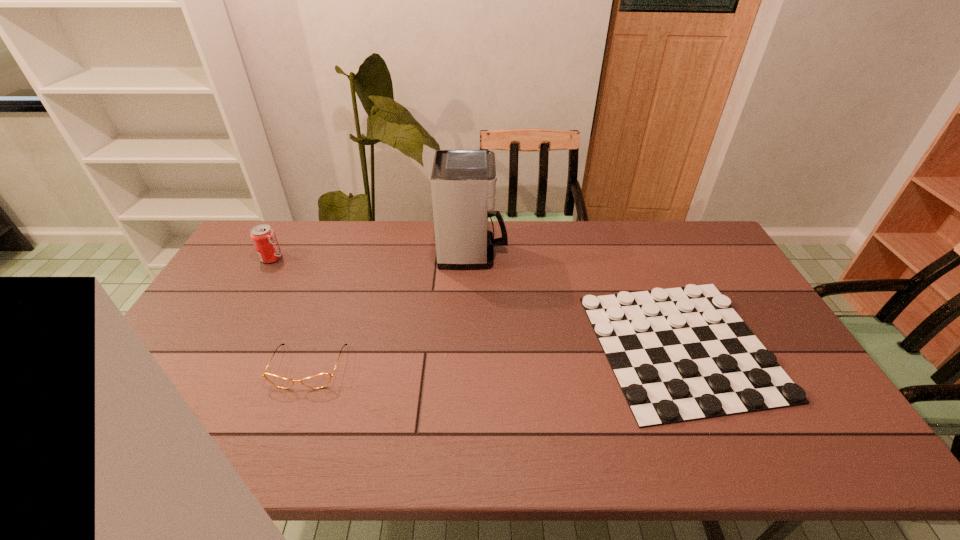
The width and height of the screenshot is (960, 540). Identify the location of the third object from left to right. click(463, 182).

Identify the location of coffee maker. The image size is (960, 540). (463, 182).

At what (x,y) coordinates should I click in order to perform the action: click on soda can. Please return your answer as a coordinate pair (x, y). Looking at the image, I should click on (264, 239).

You are a GUI agent. You are given a task and a screenshot of the screen. Output one action in this format:
    pyautogui.click(x=<x>, y=<y>)
    Task: Click on the leftmost object
    
    Given the screenshot: What is the action you would take?
    pyautogui.click(x=264, y=239)

This screenshot has height=540, width=960. I want to click on the second object from left to right, so click(318, 381).

In order to click on the second shortest object in this screenshot , I will do pos(318,381).

At what (x,y) coordinates should I click in order to perform the action: click on gameboard. Please return your answer as a coordinate pair (x, y). The image size is (960, 540). Looking at the image, I should click on (680, 354).

You are a GUI agent. You are given a task and a screenshot of the screen. Output one action in this format:
    pyautogui.click(x=<x>, y=<y>)
    Task: Click on the rightmost object
    The image size is (960, 540).
    Given the screenshot: What is the action you would take?
    pyautogui.click(x=680, y=354)

The height and width of the screenshot is (540, 960). I want to click on vacant space located 0.260m on the front panel of the third object from left to right, so click(581, 253).

At what (x,y) coordinates should I click in order to perform the action: click on vacant point located 0.080m on the front of the leftmost object. Please return your answer as a coordinate pair (x, y). This screenshot has height=540, width=960. Looking at the image, I should click on tap(259, 280).